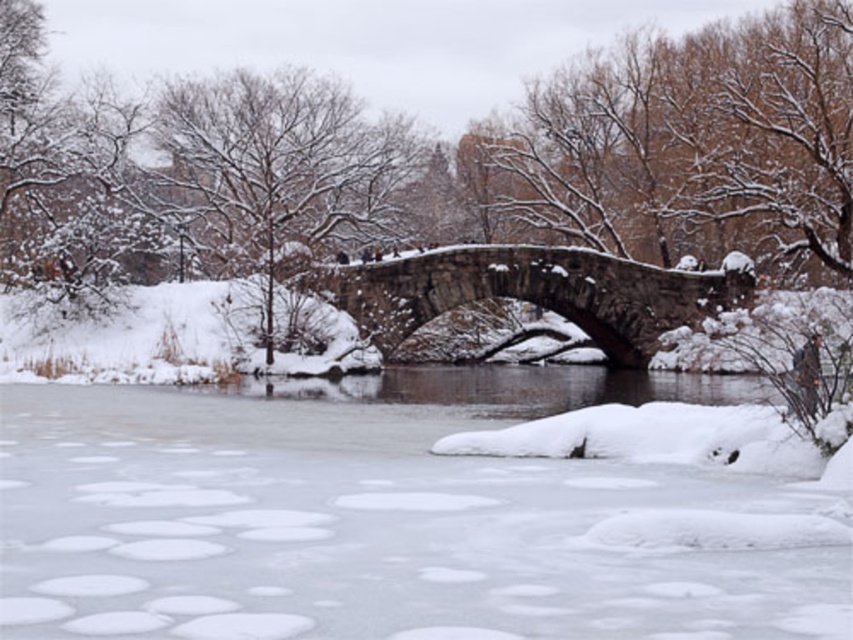
Question: Where is transparent ice at center located in relation to snow-covered tree at upper center in the image?

Choices:
 (A) above
 (B) below

Answer: (B)

Question: Which of the following is the closest to the observer?

Choices:
 (A) snow-covered tree at upper center
 (B) transparent ice at center
 (C) gray stone bridge at center

Answer: (B)

Question: Is transparent ice at center above gray stone bridge at center?

Choices:
 (A) no
 (B) yes

Answer: (A)

Question: Which of the following is the closest to the observer?

Choices:
 (A) (456, 410)
 (B) (231, 204)
 (C) (555, 296)

Answer: (A)

Question: Can you confirm if snow-covered tree at upper center is thinner than gray stone bridge at center?

Choices:
 (A) yes
 (B) no

Answer: (A)

Question: Among these objects, which one is farthest from the camera?

Choices:
 (A) gray stone bridge at center
 (B) transparent ice at center

Answer: (A)